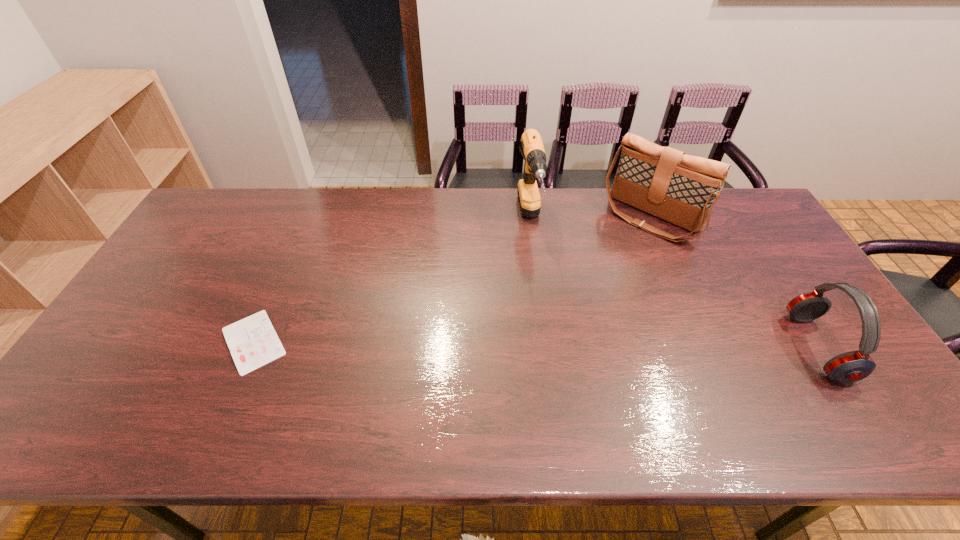
This screenshot has width=960, height=540. I want to click on the shortest object, so click(x=253, y=342).

You are a GUI agent. You are given a task and a screenshot of the screen. Output one action in this format:
    pyautogui.click(x=<x>, y=<y>)
    Task: Click on the leftmost object
    Image resolution: width=960 pixels, height=540 pixels.
    Given the screenshot: What is the action you would take?
    pyautogui.click(x=253, y=342)

The image size is (960, 540). I want to click on the third tallest object, so [x=852, y=366].

What are the coordinates of `earphone` in the screenshot? It's located at (852, 366).

Find the location of a particular element. This screenshot has height=540, width=960. the second object from left to right is located at coordinates (535, 165).

Where is `shoulder bag`? Image resolution: width=960 pixels, height=540 pixels. shoulder bag is located at coordinates (681, 189).

Locate an element on the screen. vacant space located 0.350m on the back of the leftmost object is located at coordinates (302, 228).

Identify the location of free space located at the tip of the drill. Image resolution: width=960 pixels, height=540 pixels. (540, 282).

Where is `vacant space located 0.110m at the tip of the drill`? vacant space located 0.110m at the tip of the drill is located at coordinates (540, 280).

You are a GUI agent. You are given a task and a screenshot of the screen. Output one action in this format:
    pyautogui.click(x=<x>, y=<y>)
    Task: Click on the free region located 0.340m at the tip of the drill
    
    Given the screenshot: What is the action you would take?
    pyautogui.click(x=553, y=344)